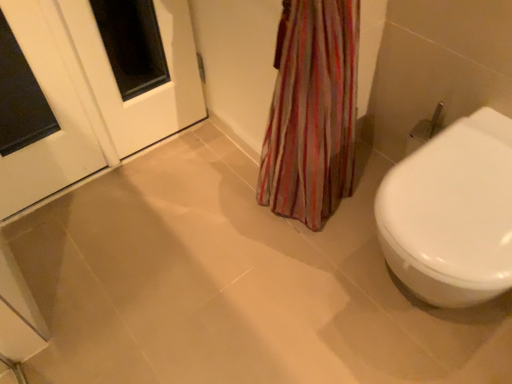
Find the location of a particular element. free area in between white glossy door at upper left and white glossy door at upper left is located at coordinates (88, 195).